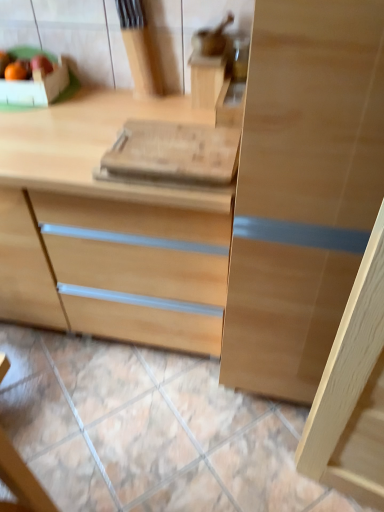
Question: Is matte wooden apple at upper left spatially inside natural wood chest of drawers at center, or outside of it?

Choices:
 (A) inside
 (B) outside

Answer: (B)

Question: Is matte wooden apple at upper left wider or thinner than natural wood chest of drawers at center?

Choices:
 (A) wide
 (B) thin

Answer: (B)

Question: Considering the real-world distances, which object is closest to the natural stone tile at lower center?

Choices:
 (A) matte wooden apple at upper left
 (B) natural wood chest of drawers at center

Answer: (B)

Question: Which object is positioned closest to the matte wooden apple at upper left?

Choices:
 (A) natural wood chest of drawers at center
 (B) natural stone tile at lower center

Answer: (A)